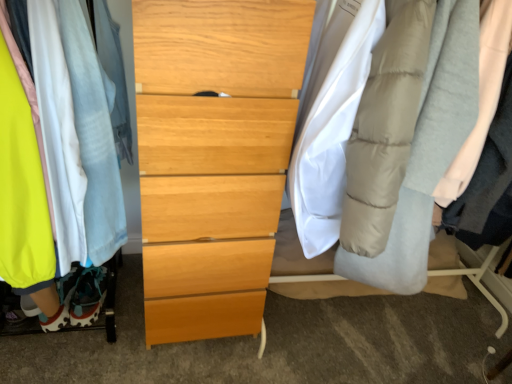
Question: Is matte fabric clothes at left far away from light wood chest of drawers at center?

Choices:
 (A) yes
 (B) no

Answer: (B)

Question: From the image's perspective, is matte fabric clothes at left on light wood chest of drawers at center?

Choices:
 (A) yes
 (B) no

Answer: (A)

Question: Could you tell me if matte fabric clothes at left is turned towards light wood chest of drawers at center?

Choices:
 (A) no
 (B) yes

Answer: (A)

Question: Is matte fabric clothes at left bigger than light wood chest of drawers at center?

Choices:
 (A) yes
 (B) no

Answer: (B)

Question: Is matte fabric clothes at left behind light wood chest of drawers at center?

Choices:
 (A) yes
 (B) no

Answer: (B)

Question: Considering the positions of light blue cotton robe at left, the 2th robe positioned from the right, and light gray quilted robe at right, the first robe in the right-to-left sequence, in the image, is light blue cotton robe at left, the 2th robe positioned from the right, bigger or smaller than light gray quilted robe at right, the first robe in the right-to-left sequence,?

Choices:
 (A) small
 (B) big

Answer: (B)

Question: Is point (110, 89) positioned closer to the camera than point (474, 178)?

Choices:
 (A) closer
 (B) farther

Answer: (A)

Question: Is light blue cotton robe at left, which is counted as the 1th robe, starting from the left, inside or outside of light gray quilted robe at right, which appears as the 2th robe when viewed from the left?

Choices:
 (A) outside
 (B) inside

Answer: (A)

Question: In the image, is light blue cotton robe at left, the 2th robe positioned from the right, on the left side or the right side of light gray quilted robe at right, the first robe in the right-to-left sequence?

Choices:
 (A) left
 (B) right

Answer: (A)

Question: Does point (474, 226) appear closer or farther from the camera than point (80, 233)?

Choices:
 (A) closer
 (B) farther

Answer: (B)

Question: In terms of width, does light gray quilted robe at right, the first robe in the right-to-left sequence, look wider or thinner when compared to light blue cotton robe at left, the 2th robe positioned from the right?

Choices:
 (A) thin
 (B) wide

Answer: (A)

Question: From a real-world perspective, is light gray quilted robe at right, which appears as the 2th robe when viewed from the left, positioned above or below light blue cotton robe at left, which is counted as the 1th robe, starting from the left?

Choices:
 (A) below
 (B) above

Answer: (B)

Question: From the image's perspective, is light gray quilted robe at right, the first robe in the right-to-left sequence, located above or below light blue cotton robe at left, which is counted as the 1th robe, starting from the left?

Choices:
 (A) above
 (B) below

Answer: (B)

Question: In the image, is matte fabric clothes at left on the left side or the right side of light blue cotton robe at left, which is counted as the 1th robe, starting from the left?

Choices:
 (A) left
 (B) right

Answer: (A)

Question: Relative to light blue cotton robe at left, which is counted as the 1th robe, starting from the left, is matte fabric clothes at left in front or behind?

Choices:
 (A) behind
 (B) front

Answer: (B)